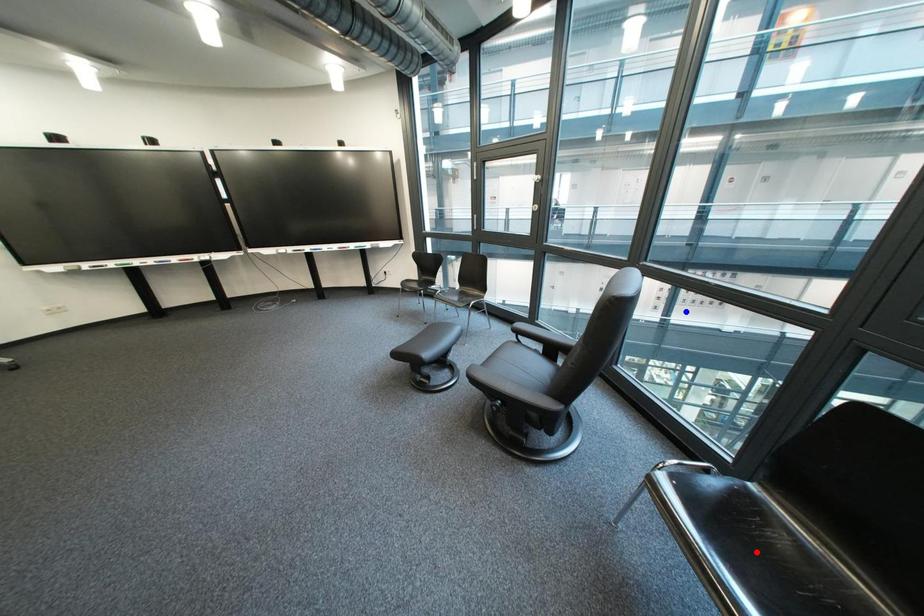
Question: In the image, two points are highlighted. Which point is nearer to the camera? Reply with the corresponding letter.

Choices:
 (A) blue point
 (B) red point

Answer: (B)